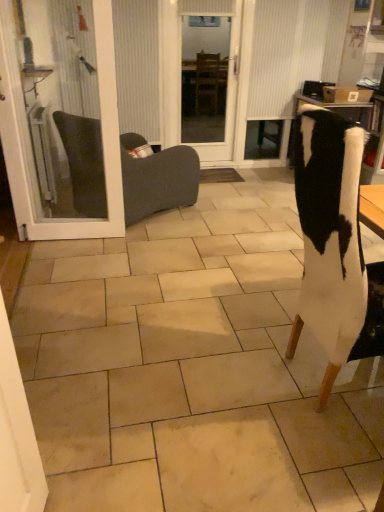
What are the coordinates of `vacant space underneath white fur chair at right, which is counted as the first chair, starting from the front (from a real-world perspective)` in the screenshot? It's located at (334, 384).